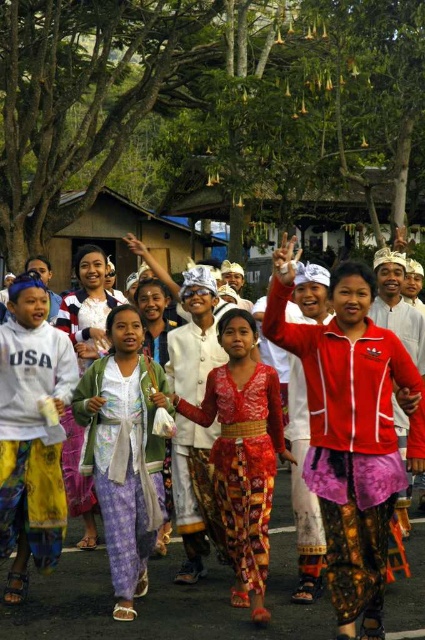
You are organizing a dance performance where participants need to move closely in a line. Given the light purple batik pants at center and the bright red batik dress at center, which clothing item allows for more comfortable movement due to its width?

The bright red batik dress at center allows for more comfortable movement because it has a greater width compared to the light purple batik pants at center.

You are organizing a fashion show and need to determine the order of the models wearing the red satin dress at center and the bright red batik dress at center. Based on their widths, which dress should be placed first if you want the wider one to walk the runway first?

The red satin dress at center might be wider than bright red batik dress at center, so the model wearing the red satin dress at center should walk first.